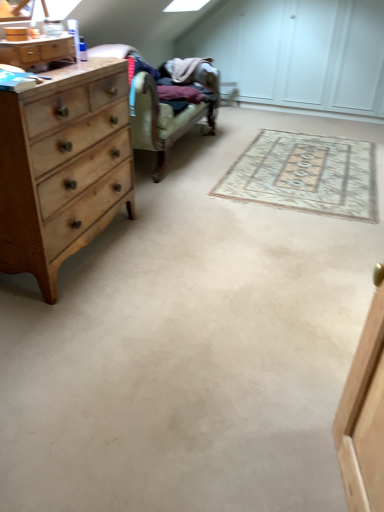
Question: Is light brown wood chest of drawers at left further to camera compared to beige woven rug at center?

Choices:
 (A) yes
 (B) no

Answer: (B)

Question: Is light brown wood chest of drawers at left oriented towards beige woven rug at center?

Choices:
 (A) yes
 (B) no

Answer: (B)

Question: Can you confirm if light brown wood chest of drawers at left is smaller than beige woven rug at center?

Choices:
 (A) yes
 (B) no

Answer: (B)

Question: Considering the relative sizes of light brown wood chest of drawers at left and beige woven rug at center in the image provided, is light brown wood chest of drawers at left bigger than beige woven rug at center?

Choices:
 (A) no
 (B) yes

Answer: (B)

Question: Considering the relative sizes of light brown wood chest of drawers at left and beige woven rug at center in the image provided, is light brown wood chest of drawers at left thinner than beige woven rug at center?

Choices:
 (A) no
 (B) yes

Answer: (B)

Question: Can you see light brown wood chest of drawers at left touching beige woven rug at center?

Choices:
 (A) yes
 (B) no

Answer: (B)

Question: Is beige woven rug at center to the right of light brown wood chest of drawers at left from the viewer's perspective?

Choices:
 (A) yes
 (B) no

Answer: (A)

Question: From the image's perspective, does beige woven rug at center appear lower than light brown wood chest of drawers at left?

Choices:
 (A) no
 (B) yes

Answer: (A)

Question: From the image's perspective, does beige woven rug at center appear higher than light brown wood chest of drawers at left?

Choices:
 (A) yes
 (B) no

Answer: (A)

Question: From a real-world perspective, does beige woven rug at center sit lower than light brown wood chest of drawers at left?

Choices:
 (A) no
 (B) yes

Answer: (B)

Question: Is light brown wood chest of drawers at left completely or partially inside beige woven rug at center?

Choices:
 (A) no
 (B) yes

Answer: (A)

Question: Is beige woven rug at center positioned with its back to light brown wood chest of drawers at left?

Choices:
 (A) yes
 (B) no

Answer: (B)

Question: Is beige woven rug at center smaller than wooden dresser at left?

Choices:
 (A) yes
 (B) no

Answer: (B)